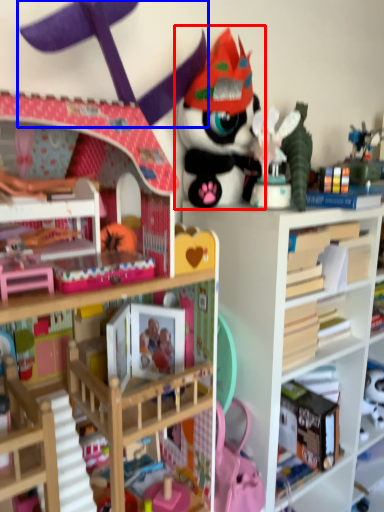
Question: Which object is closer to the camera taking this photo, toy (highlighted by a red box) or toy (highlighted by a blue box)?

Choices:
 (A) toy
 (B) toy

Answer: (B)